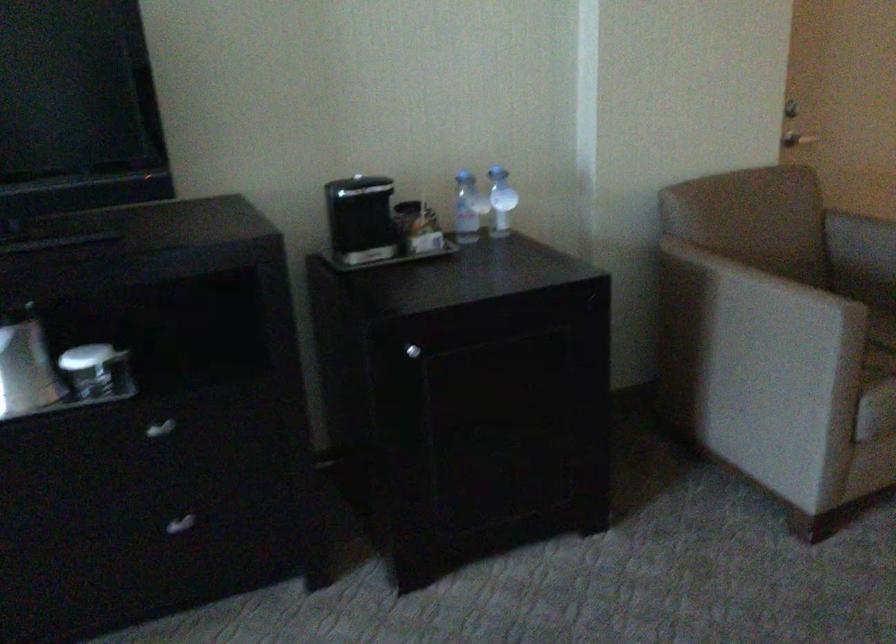
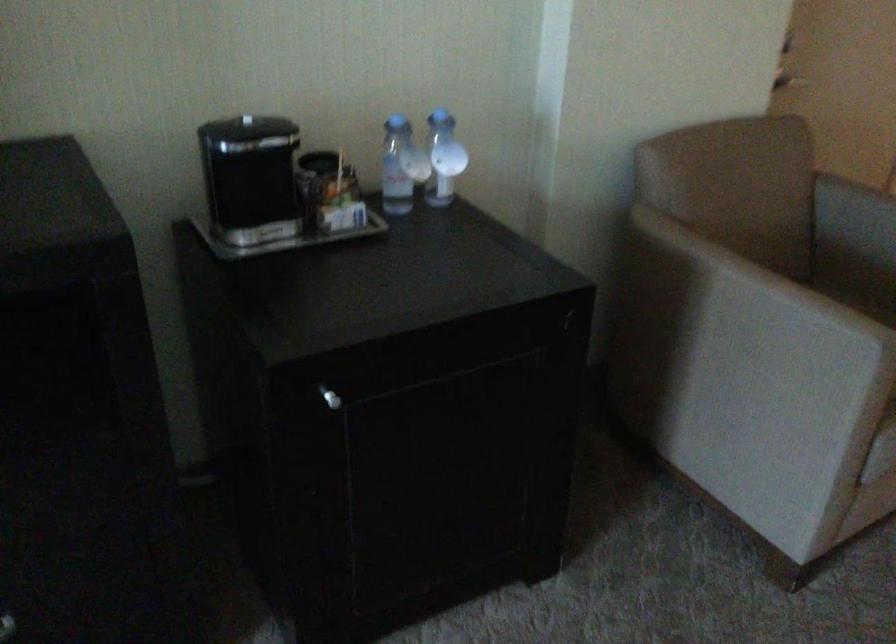
Locate, in the second image, the point that corresponds to point (501, 196) in the first image.

(443, 158)